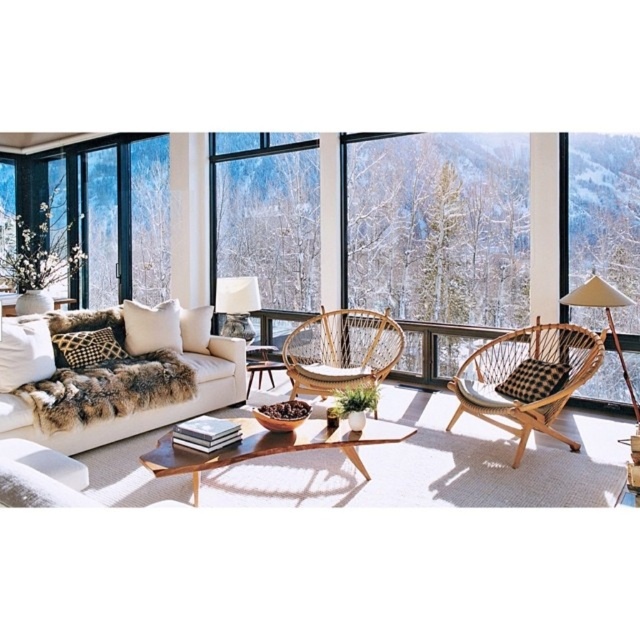
What do you see at coordinates (268, 214) in the screenshot? The image size is (640, 640). I see `clear glass window at center` at bounding box center [268, 214].

Which is more to the right, clear glass window at center or clear glass window at upper left?

clear glass window at center is more to the right.

Who is more distant from viewer, (294, 230) or (116, 285)?

The point (116, 285) is behind.

Find the location of `clear glass window at center`. clear glass window at center is located at coordinates (268, 214).

Image resolution: width=640 pixels, height=640 pixels. What do you see at coordinates (120, 220) in the screenshot?
I see `clear glass window at upper left` at bounding box center [120, 220].

Find the location of a particular element. clear glass window at upper left is located at coordinates (120, 220).

Can you confirm if white fur-covered couch at left is thinner than woven rattan chair at center?

No.

Is point (140, 419) closer to camera compared to point (310, 339)?

Yes, point (140, 419) is in front of point (310, 339).

This screenshot has width=640, height=640. What are the coordinates of `white fur-covered couch at left` in the screenshot? It's located at (156, 401).